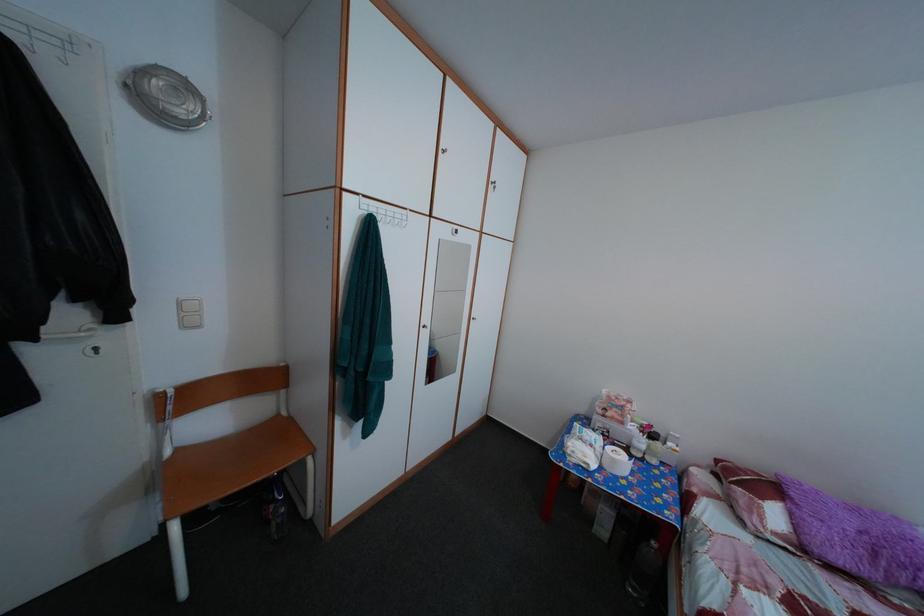
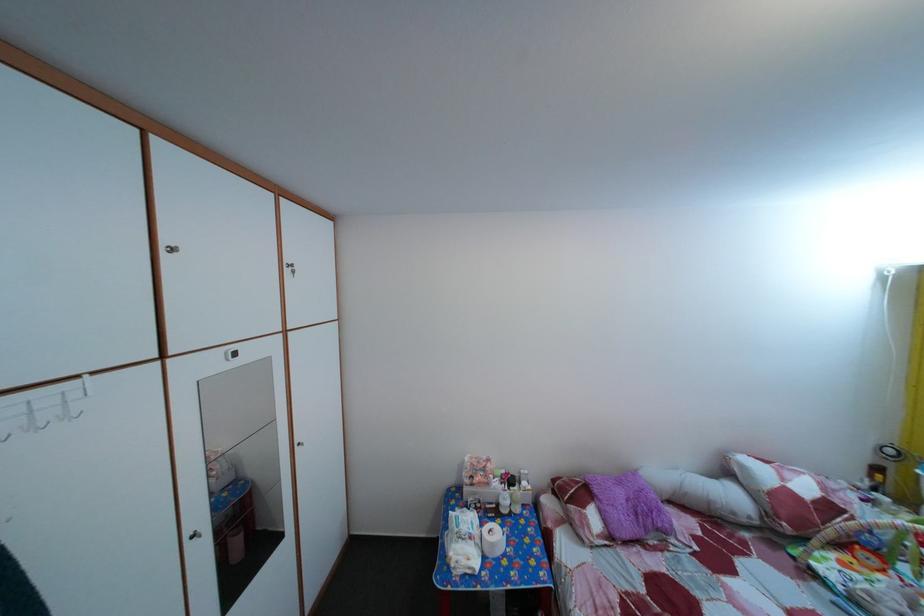
In the second image, find the point that corresponds to [505,196] in the first image.

(304, 280)